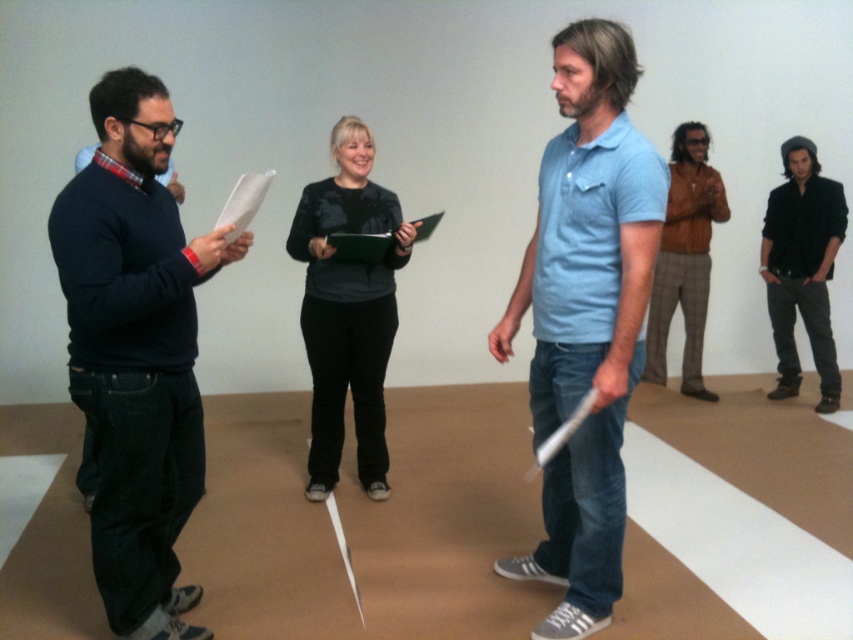
Question: Which of the following is the farthest from the observer?

Choices:
 (A) brown leather jacket at right
 (B) matte black sweater at left

Answer: (A)

Question: Can you confirm if black matte sweater at center is bigger than brown leather jacket at right?

Choices:
 (A) no
 (B) yes

Answer: (B)

Question: Is matte black sweater at left to the right of black matte shirt at upper right from the viewer's perspective?

Choices:
 (A) no
 (B) yes

Answer: (A)

Question: Which point appears farthest from the camera in this image?

Choices:
 (A) coord(624,173)
 (B) coord(653,289)
 (C) coord(105,406)

Answer: (B)

Question: Can you confirm if matte black sweater at left is wider than brown leather jacket at right?

Choices:
 (A) no
 (B) yes

Answer: (B)

Question: Which point is closer to the camera taking this photo?

Choices:
 (A) (625, 92)
 (B) (653, 326)
 (C) (310, 314)
 (D) (770, 269)

Answer: (A)